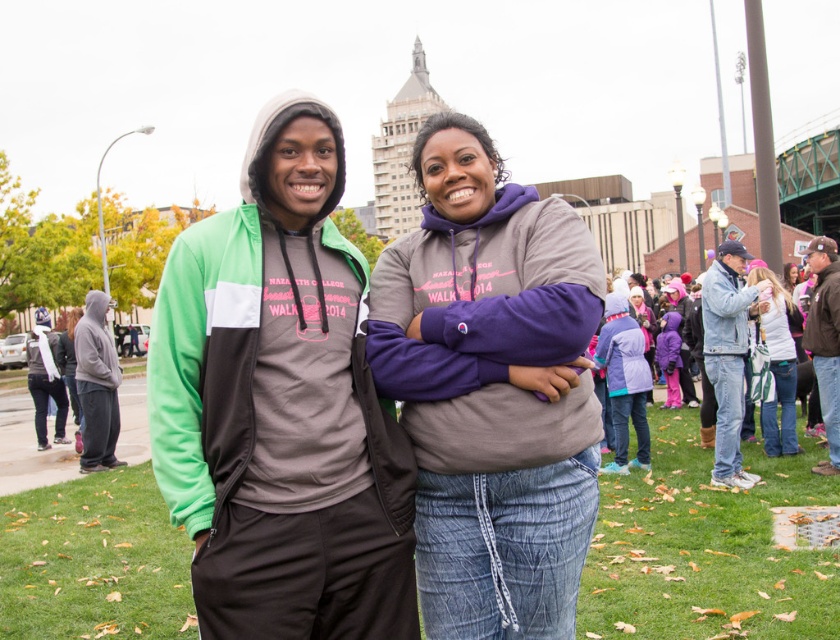
The width and height of the screenshot is (840, 640). Find the location of `matte gray hoodie at center`. matte gray hoodie at center is located at coordinates (491, 388).

Which of these two, matte gray hoodie at center or gray fleece sweatshirt at left, stands shorter?

gray fleece sweatshirt at left

Who is more distant from viewer, (486, 385) or (92, 330)?

The point (92, 330) is behind.

What are the coordinates of `matte gray hoodie at center` in the screenshot? It's located at (491, 388).

Does matte gray hoodie at center lie in front of white fleece jacket at right?

Yes.

Between point (516, 257) and point (768, 435), which one is positioned in front?

Point (516, 257) is more forward.

Image resolution: width=840 pixels, height=640 pixels. What do you see at coordinates (491, 388) in the screenshot?
I see `matte gray hoodie at center` at bounding box center [491, 388].

You are a GUI agent. You are given a task and a screenshot of the screen. Output one action in this format:
    pyautogui.click(x=<x>, y=<y>)
    Task: Click on the matte gray hoodie at center
    Image resolution: width=840 pixels, height=640 pixels.
    Given the screenshot: What is the action you would take?
    pyautogui.click(x=491, y=388)

Based on the photo, between green grass at center and denim sweatshirt at right, which one has more height?

denim sweatshirt at right is taller.

Between green grass at center and denim sweatshirt at right, which one appears on the left side from the viewer's perspective?

Positioned to the left is green grass at center.

What do you see at coordinates (705, 547) in the screenshot?
I see `green grass at center` at bounding box center [705, 547].

You are a GUI agent. You are given a task and a screenshot of the screen. Output one action in this format:
    pyautogui.click(x=<x>, y=<y>)
    Task: Click on the green grass at center
    The image size is (840, 640).
    Given the screenshot: What is the action you would take?
    pyautogui.click(x=705, y=547)